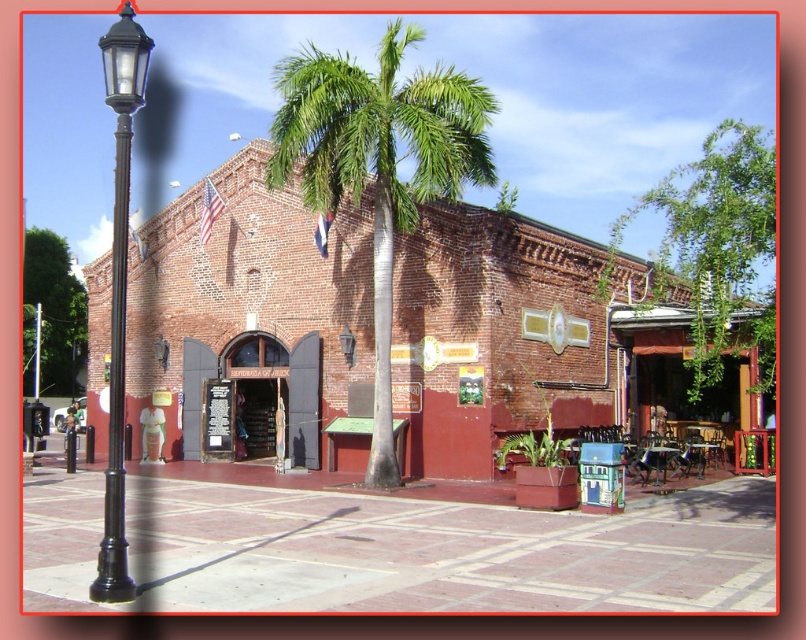
Consider the image. Can you confirm if green leafy palm tree at center is smaller than green leafy tree at upper right?

Yes.

Does green leafy palm tree at center have a larger size compared to green leafy tree at upper right?

Actually, green leafy palm tree at center might be smaller than green leafy tree at upper right.

Does point (281, 180) lie behind point (667, 285)?

No.

Image resolution: width=806 pixels, height=640 pixels. Identify the location of green leafy palm tree at center. (379, 164).

Who is positioned more to the right, green leafy tree at upper right or green leafy tree at upper left?

Positioned to the right is green leafy tree at upper right.

Which is below, green leafy tree at upper right or green leafy tree at upper left?

green leafy tree at upper left is lower down.

Which is behind, point (721, 202) or point (50, 230)?

The point (50, 230) is behind.

Locate an element on the screen. The height and width of the screenshot is (640, 806). green leafy tree at upper right is located at coordinates (717, 248).

Consider the image. Is the position of black metal/texture lamp post at left more distant than that of green leafy tree at upper left?

That is False.

Is black metal/texture lamp post at left to the left of green leafy tree at upper left from the viewer's perspective?

In fact, black metal/texture lamp post at left is to the right of green leafy tree at upper left.

Describe the element at coordinates (118, 291) in the screenshot. I see `black metal/texture lamp post at left` at that location.

This screenshot has height=640, width=806. Identify the location of black metal/texture lamp post at left. (118, 291).